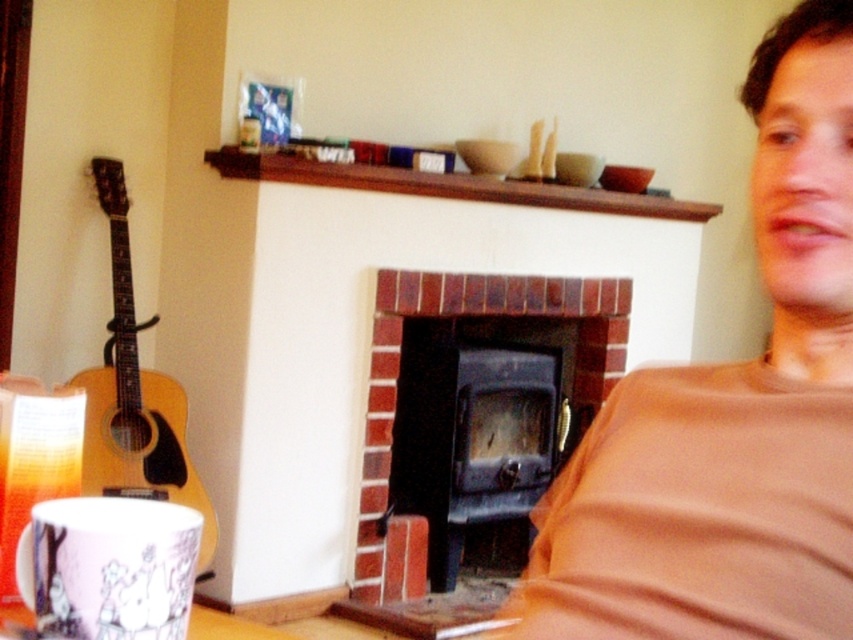
Question: Is brick fireplace at center wider than acoustic wood guitar at left?

Choices:
 (A) no
 (B) yes

Answer: (B)

Question: Among these objects, which one is nearest to the camera?

Choices:
 (A) brick fireplace at center
 (B) brown cotton shirt at right
 (C) acoustic wood guitar at left
 (D) porcelain mug with illustrations at lower left

Answer: (B)

Question: Which of the following is the farthest from the observer?

Choices:
 (A) (91, 481)
 (B) (405, 314)
 (C) (809, 112)

Answer: (B)

Question: Does brick fireplace at center appear on the left side of acoustic wood guitar at left?

Choices:
 (A) yes
 (B) no

Answer: (B)

Question: In this image, where is brick fireplace at center located relative to porcelain mug with illustrations at lower left?

Choices:
 (A) left
 (B) right

Answer: (B)

Question: Which of the following is the closest to the observer?

Choices:
 (A) brown cotton shirt at right
 (B) acoustic wood guitar at left

Answer: (A)